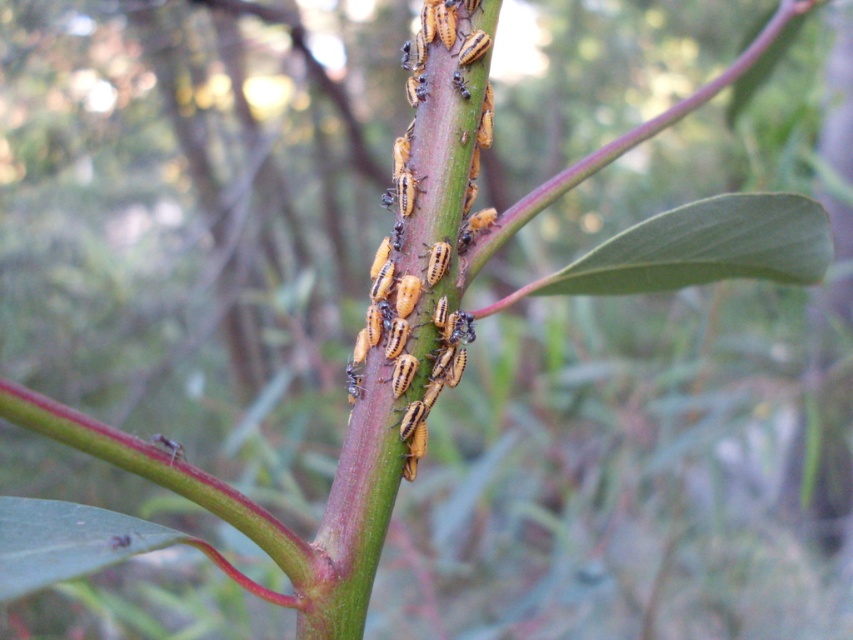
You are a photographer trying to capture a detailed shot of the yellow matte insects at center and the green smooth leaf at center. Which object should you focus on if you want the other to appear slightly out of focus?

Since the yellow matte insects at center has a lesser width compared to the green smooth leaf at center, focusing on the green smooth leaf at center would cause the yellow matte insects at center to appear out of focus, as the leaf is wider and might be positioned differently in the depth of field.

You are a gardener who wants to place a small protective cover over the yellow matte insects at center and the green smooth leaf at center. What is the minimum length of the cover needed to fully enclose both objects?

The minimum length of the cover needed to fully enclose both the yellow matte insects at center and the green smooth leaf at center is 11.38 inches, as that is the distance between them.

You are a photographer trying to capture a close shot of the yellow matte insects at center and the green smooth leaf at center. Based on the scene, which object is positioned closer to the camera?

The yellow matte insects at center is taller than the green smooth leaf at center, so the yellow matte insects at center are closer to the camera.